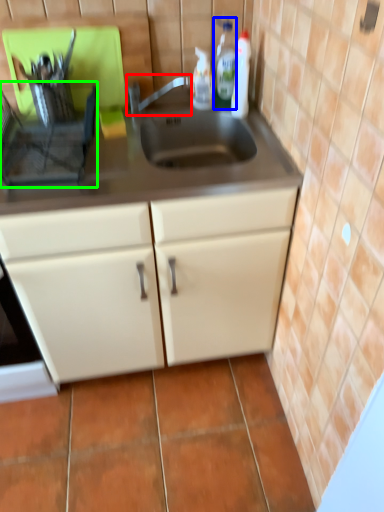
Question: Which object is the farthest from faucet (highlighted by a red box)? Choose among these: bottle (highlighted by a blue box) or appliance (highlighted by a green box).

Choices:
 (A) bottle
 (B) appliance

Answer: (B)